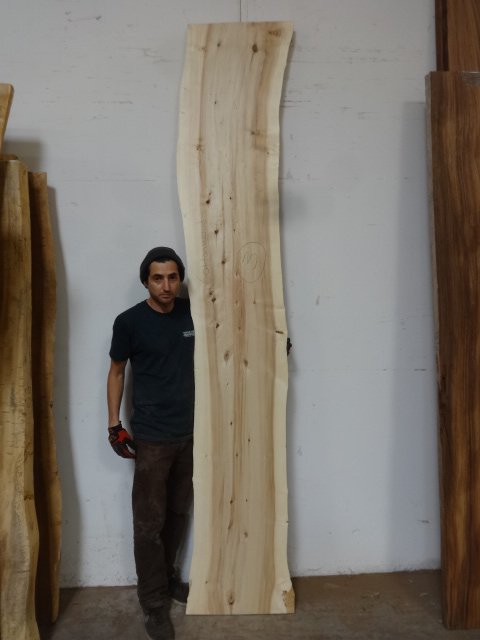
The image size is (480, 640). I want to click on brown floor, so click(325, 626).